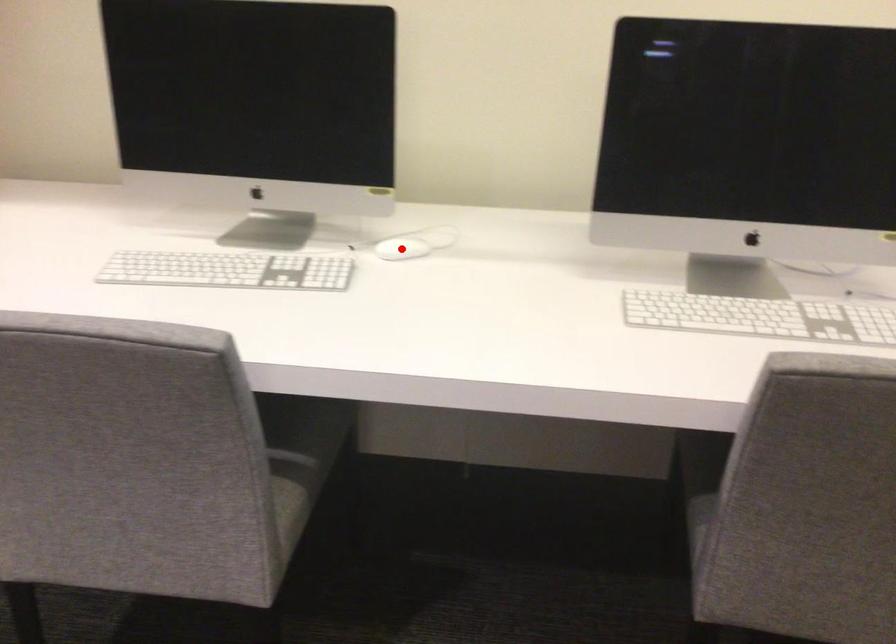
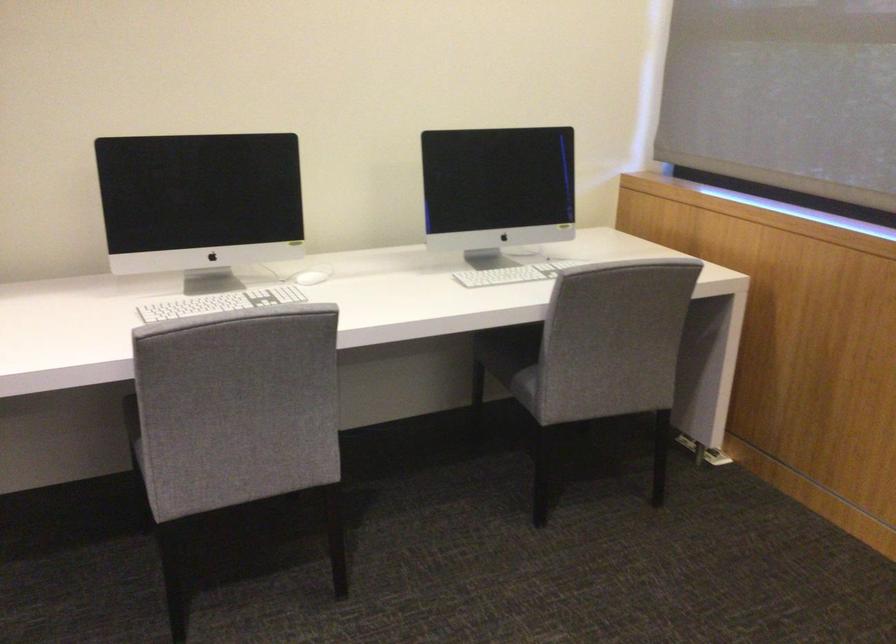
Question: I am providing you with two images of the same scene from different viewpoints. A red point is marked on the first image. Is the red point's position out of view in image 2?

Choices:
 (A) Yes
 (B) No

Answer: (B)